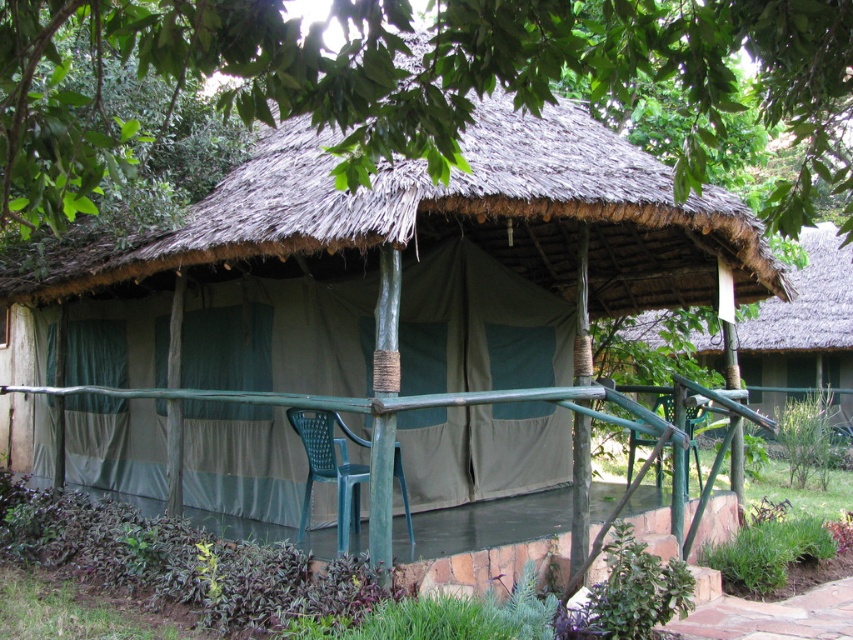
From the picture: You are planning to set up a small table for two people between the green leafy tree at upper center and the green plastic chair at center. Considering their sizes, will there be enough space between them to accommodate the table?

The green leafy tree at upper center has a lesser width compared to the green plastic chair at center, so there should be sufficient space between them to place a small table for two people.

You are planning to take a photo of the green leafy tree at upper center and the green fabric hut at center from the front. Which object will appear narrower in the photo?

The green leafy tree at upper center will appear narrower in the photo because it is thinner than the green fabric hut at center.